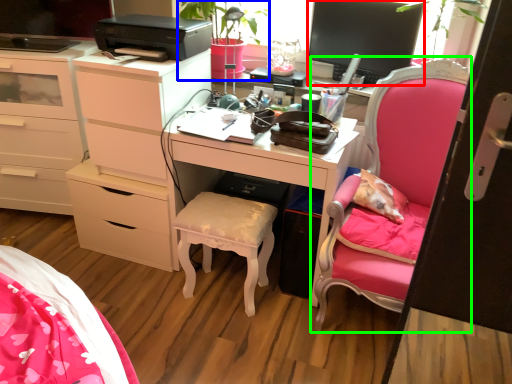
Question: Which is nearer to the television (highlighted by a red box)? houseplant (highlighted by a blue box) or chair (highlighted by a green box).

Choices:
 (A) houseplant
 (B) chair

Answer: (B)